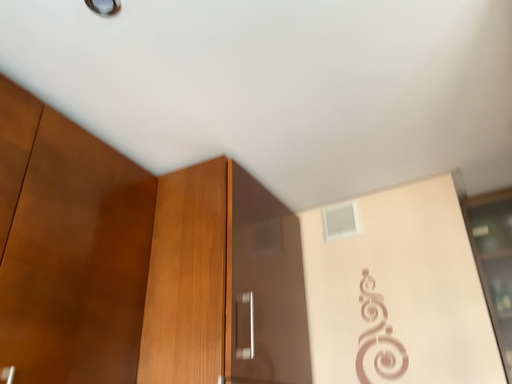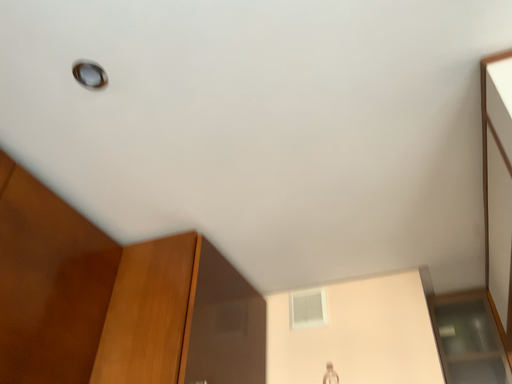
Question: How did the camera likely rotate when shooting the video?

Choices:
 (A) rotated downward
 (B) rotated upward

Answer: (B)